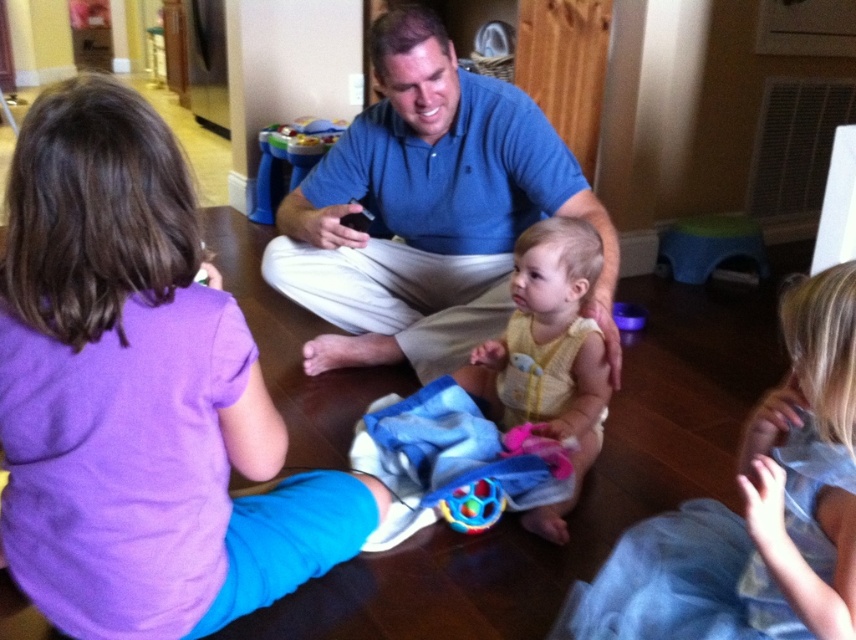
Question: Is blue cotton shirt at center thinner than rubberized plastic ball at center?

Choices:
 (A) yes
 (B) no

Answer: (B)

Question: Which of the following is the closest to the observer?

Choices:
 (A) yellow knitted vest at center
 (B) rubberized plastic ball at center
 (C) purple cotton shirt at left

Answer: (C)

Question: Can you confirm if yellow knitted vest at center is positioned below rubberized plastic ball at center?

Choices:
 (A) no
 (B) yes

Answer: (A)

Question: Estimate the real-world distances between objects in this image. Which object is closer to the light yellow knit sweater at lower right?

Choices:
 (A) purple cotton shirt at left
 (B) yellow knitted vest at center
 (C) rubberized plastic ball at center

Answer: (B)

Question: Does purple cotton shirt at left come in front of light yellow knit sweater at lower right?

Choices:
 (A) yes
 (B) no

Answer: (A)

Question: Based on their relative distances, which object is nearer to the light yellow knit sweater at lower right?

Choices:
 (A) yellow knitted vest at center
 (B) blue cotton shirt at center
 (C) rubberized plastic ball at center

Answer: (A)